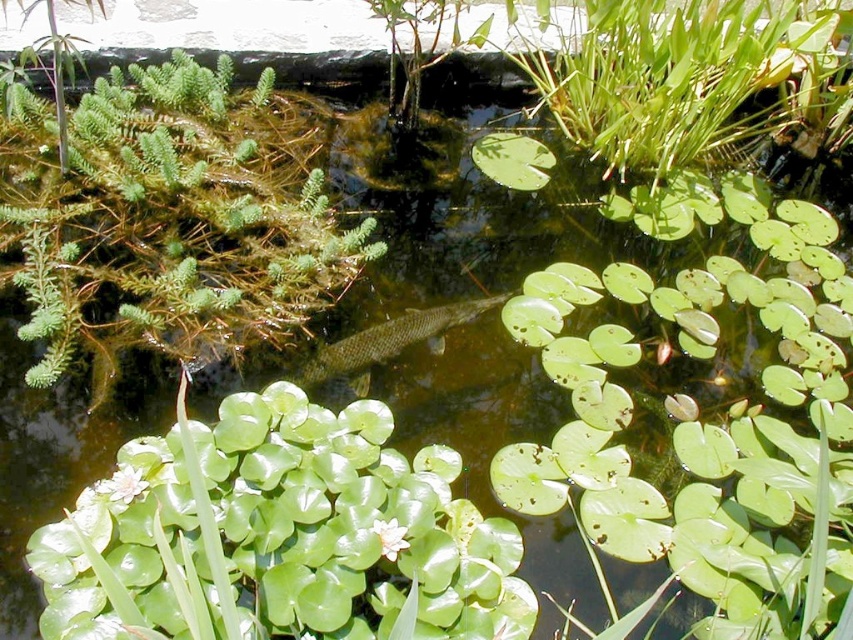
Question: Is green glossy lily pads at center smaller than green scaly fish at center?

Choices:
 (A) no
 (B) yes

Answer: (A)

Question: From the image, what is the correct spatial relationship of green glossy lily pads at center in relation to green scaly fish at center?

Choices:
 (A) below
 (B) above

Answer: (A)

Question: Which point appears closest to the camera in this image?

Choices:
 (A) (357, 368)
 (B) (190, 266)
 (C) (195, 449)

Answer: (C)

Question: Which object appears closest to the camera in this image?

Choices:
 (A) green scaly fish at center
 (B) green glossy lily pads at center
 (C) green fuzzy plant at upper left

Answer: (B)

Question: Can you confirm if green glossy lily pads at center is smaller than green scaly fish at center?

Choices:
 (A) no
 (B) yes

Answer: (A)

Question: Which point is farther to the camera?

Choices:
 (A) (346, 339)
 (B) (109, 172)

Answer: (A)